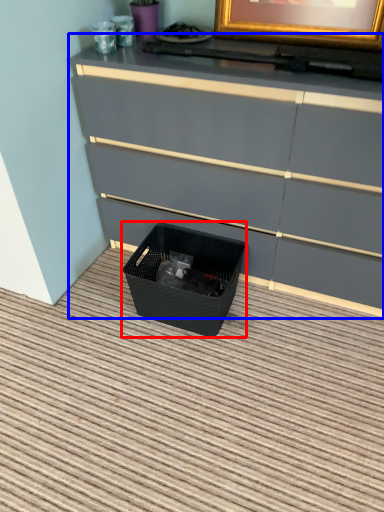
Question: Which point is closer to the camera, basket container (highlighted by a red box) or chest of drawers (highlighted by a blue box)?

Choices:
 (A) basket container
 (B) chest of drawers

Answer: (B)